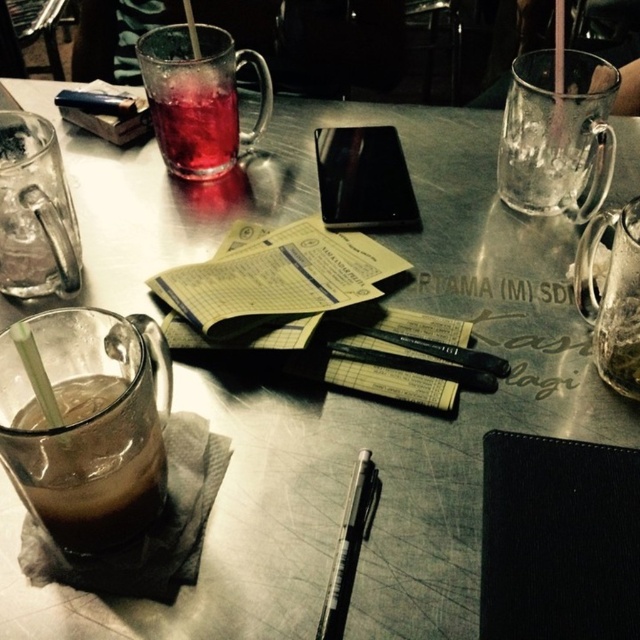
Is black leather notebook at lower right behind yellow paper notebook at center?

That is False.

This screenshot has height=640, width=640. In order to click on black leather notebook at lower right in this screenshot , I will do `click(557, 540)`.

Locate an element on the screen. This screenshot has width=640, height=640. black leather notebook at lower right is located at coordinates pos(557,540).

Where is `black leather notebook at lower right`? Image resolution: width=640 pixels, height=640 pixels. black leather notebook at lower right is located at coordinates (x=557, y=540).

Who is more distant from viewer, [292,305] or [36,372]?

The point [292,305] is behind.

Between yellow paper notebook at center and clear plastic straw at lower left, which one has more height?

With more height is yellow paper notebook at center.

At what (x,y) coordinates should I click in order to perform the action: click on yellow paper notebook at center. Please return your answer as a coordinate pair (x, y). This screenshot has height=640, width=640. Looking at the image, I should click on (276, 280).

Does point (364, 465) come closer to viewer compared to point (20, 337)?

No, (364, 465) is further to viewer.

Which is behind, point (346, 522) or point (36, 364)?

Point (346, 522)

What are the coordinates of `black metallic pen at center` in the screenshot? It's located at (349, 545).